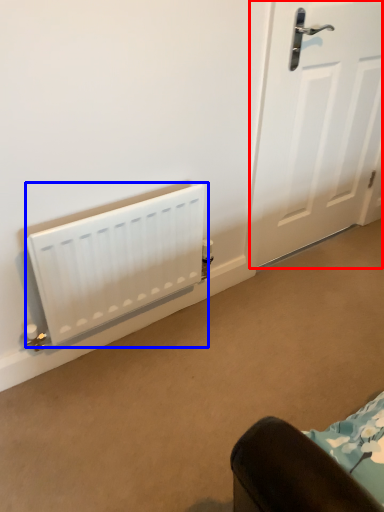
Question: Which object is further to the camera taking this photo, door (highlighted by a red box) or radiator (highlighted by a blue box)?

Choices:
 (A) door
 (B) radiator

Answer: (A)